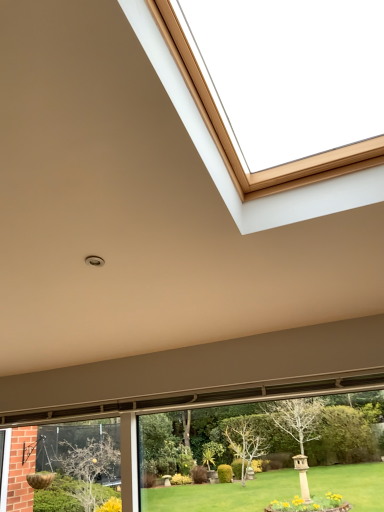
Locate an element on the screen. This screenshot has height=512, width=384. green leafy tree at lower center is located at coordinates (262, 435).

The image size is (384, 512). What do you see at coordinates (262, 435) in the screenshot?
I see `green leafy tree at lower center` at bounding box center [262, 435].

Find the location of a particular element. green leafy tree at lower center is located at coordinates (262, 435).